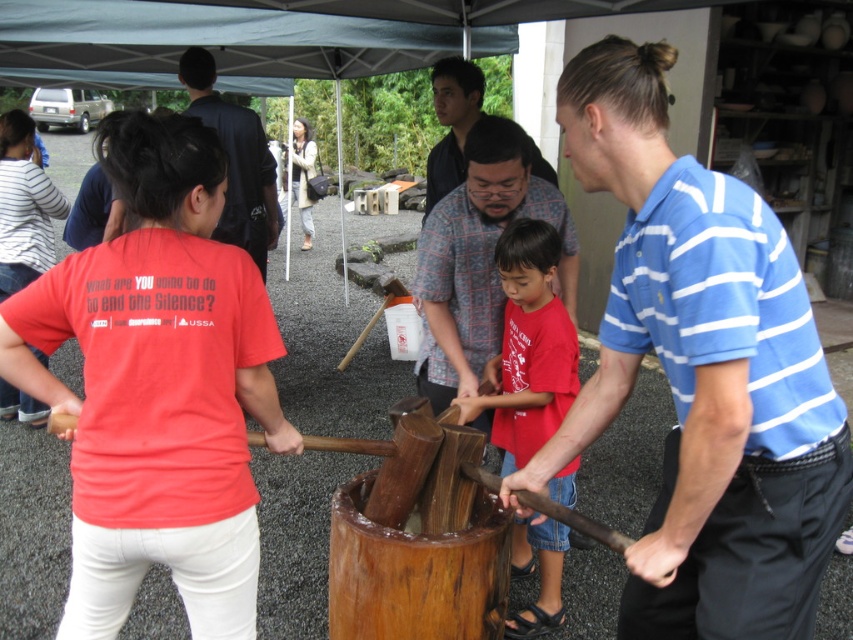
You are a photographer at this event and want to capture both the matte red shirt at center and the dark blue suit at upper left in the same frame. Given their sizes, which one should you zoom in on more to ensure both are clearly visible?

The matte red shirt at center is smaller than the dark blue suit at upper left. To include both clearly, you should zoom in more on the matte red shirt at center to balance their sizes in the photo.

You are a photographer at this event and want to capture both the blue striped shirt at center and the matte red shirt at center in the same frame. If your camera has a fixed focal length and limited depth of field, which shirt should you focus on to ensure both are in focus?

The blue striped shirt at center is larger in size compared to the matte red shirt at center, so focusing on the larger blue striped shirt at center will help keep both subjects within the depth of field.